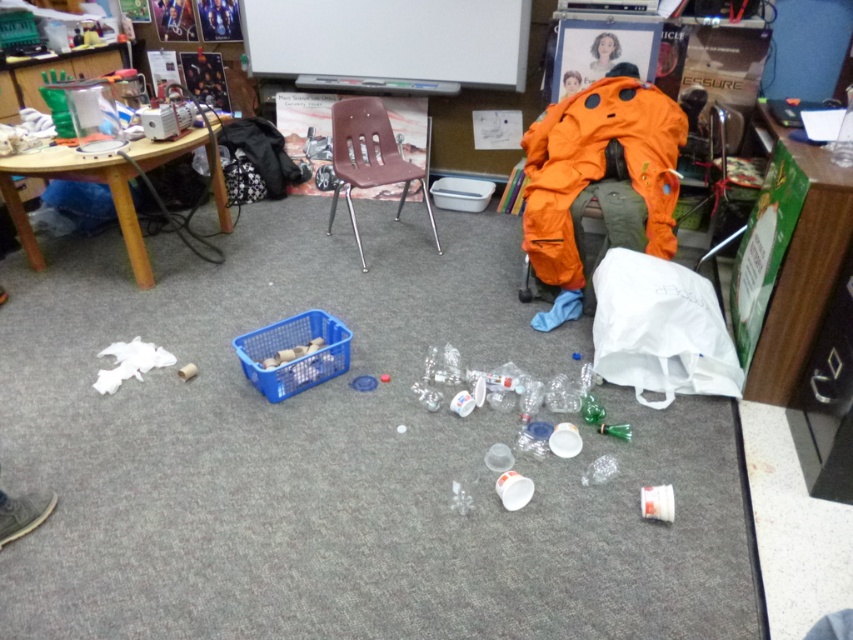
You are standing in the classroom and need to move from the blue plastic basket to the white plastic bag. Which direction should you move in relation to the two points labeled as point (x=390, y=168) and point (x=604, y=36)?

To move from the blue plastic basket to the white plastic bag, you should move away from point (x=390, y=168) and towards point (x=604, y=36) since point (x=390, y=168) is closer to you than point (x=604, y=36).